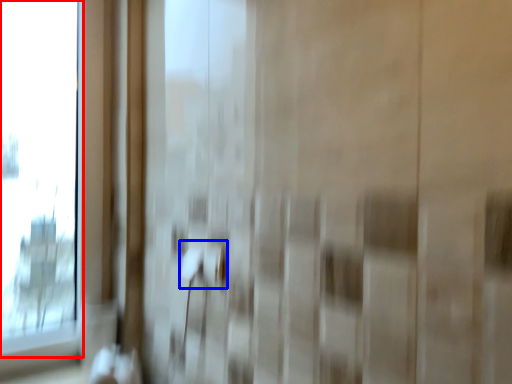
Question: Which object appears farthest to the camera in this image, window (highlighted by a red box) or door handle (highlighted by a blue box)?

Choices:
 (A) window
 (B) door handle

Answer: (A)